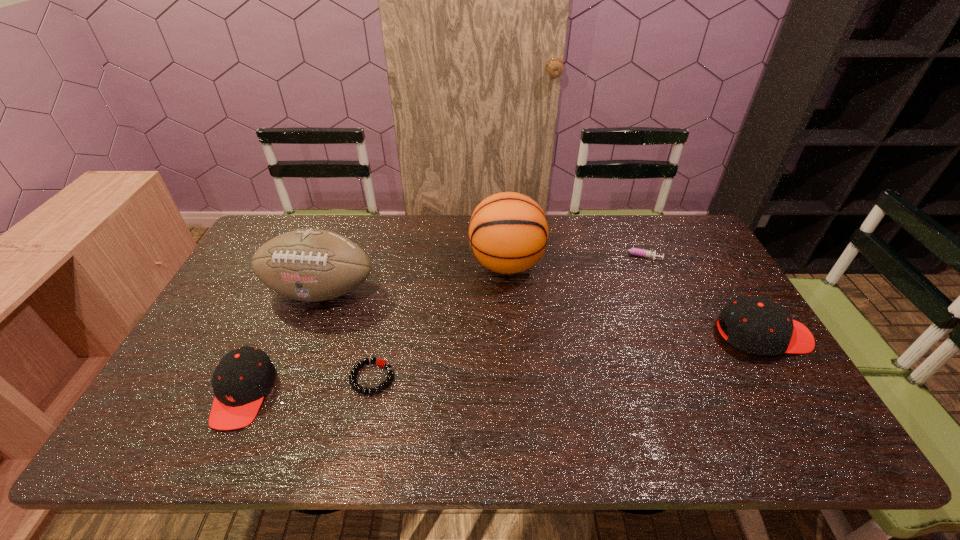
You are a GUI agent. You are given a task and a screenshot of the screen. Output one action in this format:
    pyautogui.click(x=<x>, y=<y>)
    Task: Click on the vacant area situated 0.340m on the left of the second shortest object
    
    Given the screenshot: What is the action you would take?
    pyautogui.click(x=509, y=256)

At what (x,y) coordinates should I click in order to perform the action: click on vacant space located on the right of the fourth object from left to right. Please return your answer as a coordinate pair (x, y). This screenshot has height=540, width=960. Looking at the image, I should click on (640, 264).

You are a GUI agent. You are given a task and a screenshot of the screen. Output one action in this format:
    pyautogui.click(x=<x>, y=<y>)
    Task: Click on the vacant region located 0.090m on the laces of the fifth shortest object
    Image resolution: width=960 pixels, height=540 pixels.
    Given the screenshot: What is the action you would take?
    pyautogui.click(x=301, y=341)

Find the location of a particular element. The width and height of the screenshot is (960, 540). vacant space located on the right of the shortest object is located at coordinates (503, 377).

Where is `syringe at the far edge`? syringe at the far edge is located at coordinates (634, 251).

Find the location of a particular element. The image size is (960, 540). basketball present at the far edge is located at coordinates (508, 232).

Find the location of a particular element. The width and height of the screenshot is (960, 540). cap that is at the near edge is located at coordinates (243, 376).

This screenshot has height=540, width=960. I want to click on bracelet that is at the near edge, so point(380,362).

The width and height of the screenshot is (960, 540). What are the coordinates of `cap located at the left edge` in the screenshot? It's located at (243, 376).

Locate an element on the screen. football (American) that is at the left edge is located at coordinates (311, 265).